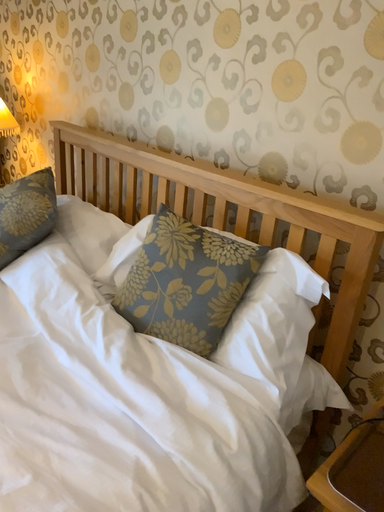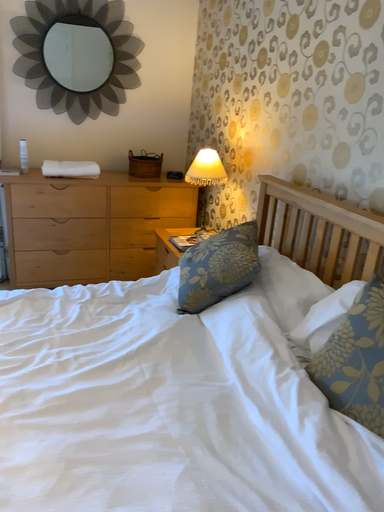
Question: Which way did the camera rotate in the video?

Choices:
 (A) rotated upward
 (B) rotated downward

Answer: (A)